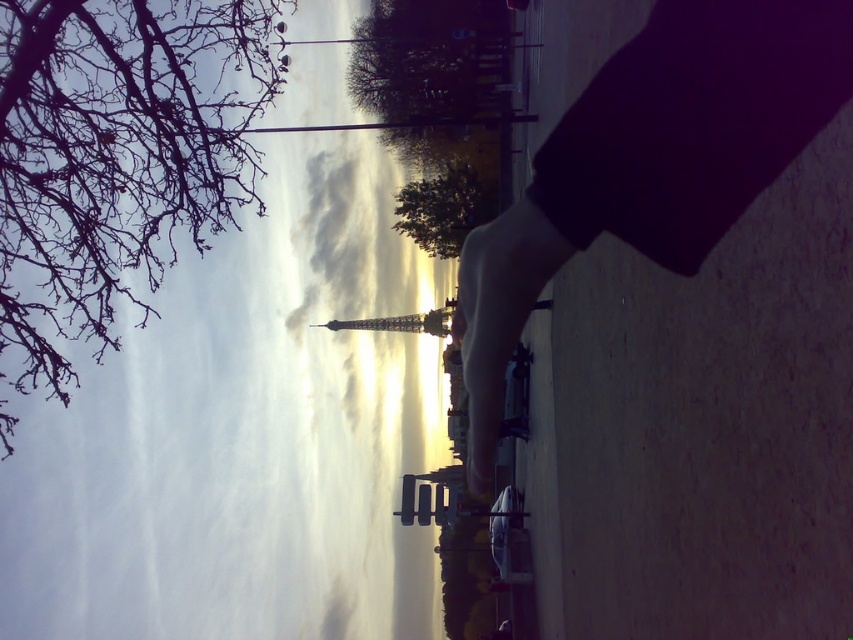
Is point (183, 179) behind point (804, 65)?

Yes, it is.

Describe the element at coordinates (115, 157) in the screenshot. Image resolution: width=853 pixels, height=640 pixels. I see `bare branches at upper left` at that location.

Locate an element on the screen. bare branches at upper left is located at coordinates (115, 157).

Is smooth black skateboard at center further to camera compared to green leafy tree at center?

No, smooth black skateboard at center is in front of green leafy tree at center.

Is smooth black skateboard at center smaller than green leafy tree at center?

No, smooth black skateboard at center is not smaller than green leafy tree at center.

Is point (550, 228) less distant than point (440, 225)?

Yes, point (550, 228) is in front of point (440, 225).

At what (x,y) coordinates should I click in order to perform the action: click on smooth black skateboard at center. Please return your answer as a coordinate pair (x, y). The image size is (853, 640). Looking at the image, I should click on (651, 163).

Is bare branches at upper left bigger than green leafy tree at center?

Yes, bare branches at upper left is bigger than green leafy tree at center.

Based on the photo, between bare branches at upper left and green leafy tree at center, which one has less height?

Standing shorter between the two is green leafy tree at center.

Measure the distance between point (21,378) and camera.

Point (21,378) is 108.29 meters away from camera.

Where is `bare branches at upper left`? This screenshot has height=640, width=853. bare branches at upper left is located at coordinates (115, 157).